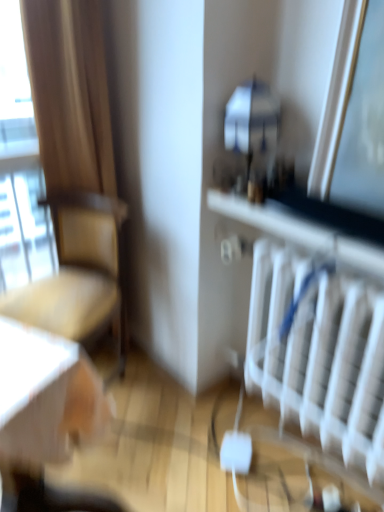
Question: Can transparent glass window at left be found inside beige fabric chair at left?

Choices:
 (A) no
 (B) yes

Answer: (A)

Question: From the image's perspective, would you say beige fabric chair at left is shown under transparent glass window at left?

Choices:
 (A) no
 (B) yes

Answer: (B)

Question: Does beige fabric chair at left lie behind transparent glass window at left?

Choices:
 (A) yes
 (B) no

Answer: (B)

Question: Is beige fabric chair at left oriented away from transparent glass window at left?

Choices:
 (A) no
 (B) yes

Answer: (A)

Question: From a real-world perspective, is beige fabric chair at left under transparent glass window at left?

Choices:
 (A) no
 (B) yes

Answer: (B)

Question: Considering the relative positions of beige fabric chair at left and transparent glass window at left in the image provided, is beige fabric chair at left to the left of transparent glass window at left from the viewer's perspective?

Choices:
 (A) no
 (B) yes

Answer: (A)

Question: Is transparent glass window at left oriented away from white plastic radiator at lower right?

Choices:
 (A) no
 (B) yes

Answer: (A)

Question: From the image's perspective, is transparent glass window at left over white plastic radiator at lower right?

Choices:
 (A) no
 (B) yes

Answer: (B)

Question: Does transparent glass window at left appear on the left side of white plastic radiator at lower right?

Choices:
 (A) yes
 (B) no

Answer: (A)

Question: Is transparent glass window at left wider than white plastic radiator at lower right?

Choices:
 (A) yes
 (B) no

Answer: (B)

Question: Is transparent glass window at left bigger than white plastic radiator at lower right?

Choices:
 (A) no
 (B) yes

Answer: (A)

Question: Is white plastic radiator at lower right located within transparent glass window at left?

Choices:
 (A) yes
 (B) no

Answer: (B)

Question: Considering the relative positions of beige fabric chair at left and white plastic radiator at lower right in the image provided, is beige fabric chair at left to the right of white plastic radiator at lower right from the viewer's perspective?

Choices:
 (A) no
 (B) yes

Answer: (A)